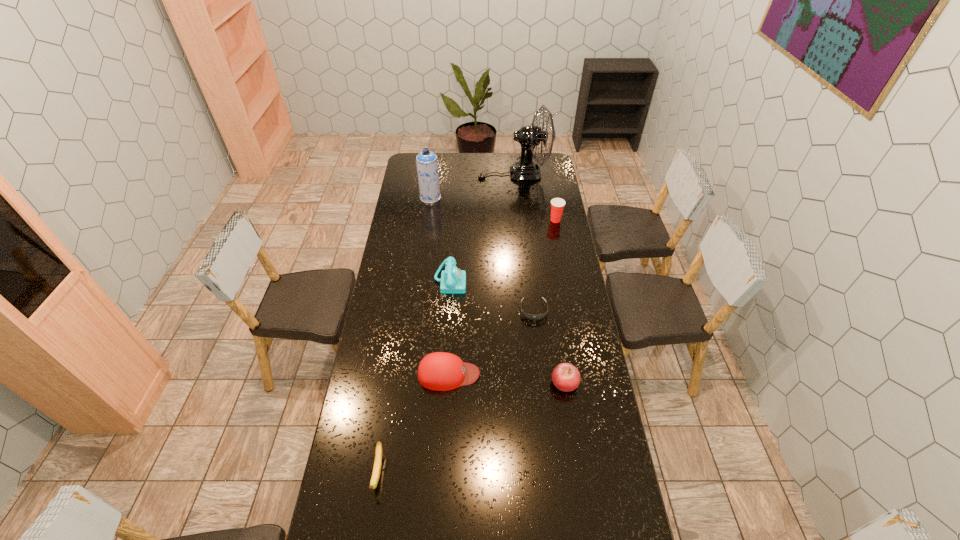
Find the location of a particular element. This screenshot has height=540, width=960. free space that is in between the baseball cap and the second farthest object is located at coordinates (440, 286).

You are a GUI agent. You are given a task and a screenshot of the screen. Output one action in this format:
    pyautogui.click(x=<x>, y=<y>)
    Task: Click on the empty space between the banana and the baseball cap
    
    Given the screenshot: What is the action you would take?
    pyautogui.click(x=414, y=423)

This screenshot has width=960, height=540. I want to click on free space between the fourth nearest object and the baseball cap, so click(492, 342).

Locate which object ranks third in proximity to the banana. Please provide its 2D coordinates. Your answer should be formatted as a tuple, i.e. [(x, y)], where the tuple contains the x and y coordinates of a point satisfying the conditions above.

[(453, 280)]

Locate an element on the screen. This screenshot has height=540, width=960. object that is the closest to the third farthest object is located at coordinates (529, 136).

The image size is (960, 540). What are the coordinates of `vacant space that satisfies the following two spatial constraints: 1. in front of the apple, indicating the direction of air flow; 2. on the right side of the farthest object` in the screenshot? It's located at (535, 383).

Find the location of a particular element. This screenshot has height=540, width=960. free space that satisfies the following two spatial constraints: 1. on the dial of the telephone; 2. at the stem of the seventh tallest object is located at coordinates (438, 472).

The width and height of the screenshot is (960, 540). Find the location of `vacant area that satisfies the following two spatial constraints: 1. on the dial of the telephone; 2. on the right side of the apple`. vacant area that satisfies the following two spatial constraints: 1. on the dial of the telephone; 2. on the right side of the apple is located at coordinates (444, 383).

Locate an element on the screen. vacant space that satisfies the following two spatial constraints: 1. on the front-facing side of the baseball cap; 2. at the stem of the second shortest object is located at coordinates (444, 472).

What are the coordinates of `vacant area in the image that satisfies the following two spatial constraints: 1. in front of the apple, indicating the direction of air flow; 2. on the right side of the tallest object` in the screenshot? It's located at (535, 383).